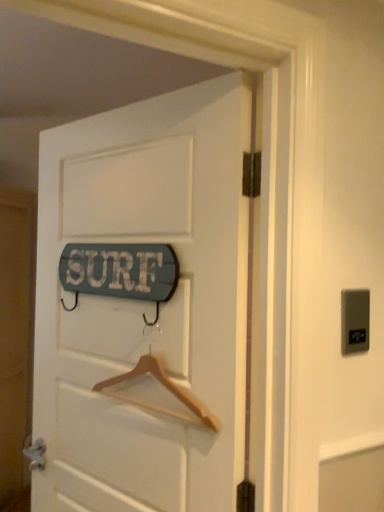
Describe the element at coordinates (156, 393) in the screenshot. This screenshot has height=512, width=384. I see `wooden hanger at center` at that location.

Find the location of `gray plastic electric outlet at upper right`. gray plastic electric outlet at upper right is located at coordinates [x=355, y=321].

From the image's perspective, is wooden hanger at center on top of gray plastic electric outlet at upper right?

Incorrect, from the image's perspective, wooden hanger at center is lower than gray plastic electric outlet at upper right.

Between wooden hanger at center and gray plastic electric outlet at upper right, which one has more height?

wooden hanger at center is taller.

Is wooden hanger at center positioned far away from gray plastic electric outlet at upper right?

No, there isn't a large distance between wooden hanger at center and gray plastic electric outlet at upper right.

In the image, is gray plastic electric outlet at upper right positioned in front of or behind wooden hanger at center?

gray plastic electric outlet at upper right is positioned farther from the viewer than wooden hanger at center.

Does gray plastic electric outlet at upper right turn towards wooden hanger at center?

No, gray plastic electric outlet at upper right is not facing towards wooden hanger at center.

Is gray plastic electric outlet at upper right spatially inside wooden hanger at center, or outside of it?

gray plastic electric outlet at upper right is not inside wooden hanger at center, it's outside.

Between wooden hanger at center and wooden signboard at center, which one has smaller size?

With smaller size is wooden hanger at center.

Is wooden hanger at center not within wooden signboard at center?

No, wooden hanger at center is not entirely external to wooden signboard at center.

In the scene shown: Considering the relative sizes of wooden hanger at center and wooden signboard at center in the image provided, is wooden hanger at center thinner than wooden signboard at center?

Correct, the width of wooden hanger at center is less than that of wooden signboard at center.

Is wooden hanger at center turned away from wooden signboard at center?

Yes, wooden hanger at center is positioned with its back facing wooden signboard at center.

Can you confirm if wooden signboard at center is bigger than gray plastic electric outlet at upper right?

Indeed, wooden signboard at center has a larger size compared to gray plastic electric outlet at upper right.

Is wooden signboard at center positioned beyond the bounds of gray plastic electric outlet at upper right?

wooden signboard at center is positioned outside gray plastic electric outlet at upper right.

Is the surface of wooden signboard at center in direct contact with gray plastic electric outlet at upper right?

No, wooden signboard at center is not making contact with gray plastic electric outlet at upper right.

Is gray plastic electric outlet at upper right not near wooden signboard at center?

No, gray plastic electric outlet at upper right is not far away from wooden signboard at center.

Would you say gray plastic electric outlet at upper right is to the left or to the right of wooden signboard at center in the picture?

gray plastic electric outlet at upper right is positioned on wooden signboard at center's right side.

Is the depth of gray plastic electric outlet at upper right greater than that of wooden signboard at center?

Yes, it is.

Is wooden signboard at center surrounding wooden hanger at center?

Yes, wooden hanger at center is surrounded by wooden signboard at center.

Are wooden signboard at center and wooden hanger at center beside each other?

wooden signboard at center and wooden hanger at center are not in contact.

Is wooden signboard at center aimed at wooden hanger at center?

Yes, wooden signboard at center is turned towards wooden hanger at center.

Locate an element on the screen. hanger that is in front of the gray plastic electric outlet at upper right is located at coordinates (156, 393).

You are a GUI agent. You are given a task and a screenshot of the screen. Output one action in this format:
    pyautogui.click(x=<x>, y=<y>)
    Task: Click on the hanger lying below the gray plastic electric outlet at upper right (from the image's perspective)
    The image size is (384, 512).
    Given the screenshot: What is the action you would take?
    pyautogui.click(x=156, y=393)

Looking at the image, which one is located closer to gray plastic electric outlet at upper right, wooden signboard at center or wooden hanger at center?

The object closer to gray plastic electric outlet at upper right is wooden hanger at center.

Considering their positions, is gray plastic electric outlet at upper right positioned further to wooden hanger at center than wooden signboard at center?

gray plastic electric outlet at upper right.

In the scene shown: From the image, which object appears to be nearer to wooden hanger at center, wooden signboard at center or gray plastic electric outlet at upper right?

wooden signboard at center.

Considering their positions, is wooden hanger at center positioned closer to wooden signboard at center than gray plastic electric outlet at upper right?

Among the two, wooden hanger at center is located nearer to wooden signboard at center.

Which object lies further to the anchor point gray plastic electric outlet at upper right, wooden hanger at center or wooden signboard at center?

The object further to gray plastic electric outlet at upper right is wooden signboard at center.

Which object lies further to the anchor point wooden signboard at center, gray plastic electric outlet at upper right or wooden hanger at center?

Among the two, gray plastic electric outlet at upper right is located further to wooden signboard at center.

Identify the location of hanger situated between wooden signboard at center and gray plastic electric outlet at upper right from left to right. (156, 393).